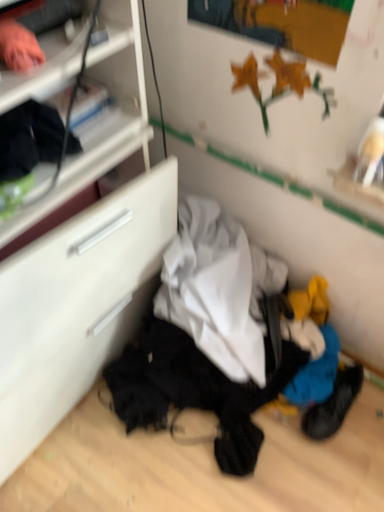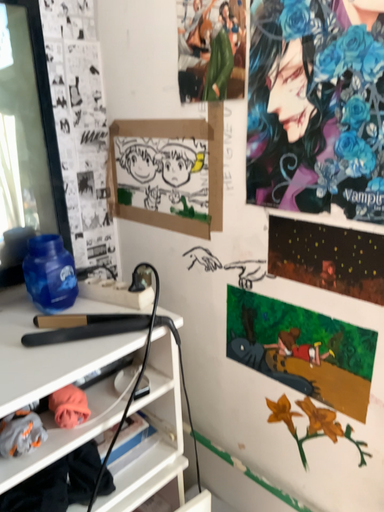
Question: Which way did the camera rotate in the video?

Choices:
 (A) rotated downward
 (B) rotated upward

Answer: (B)